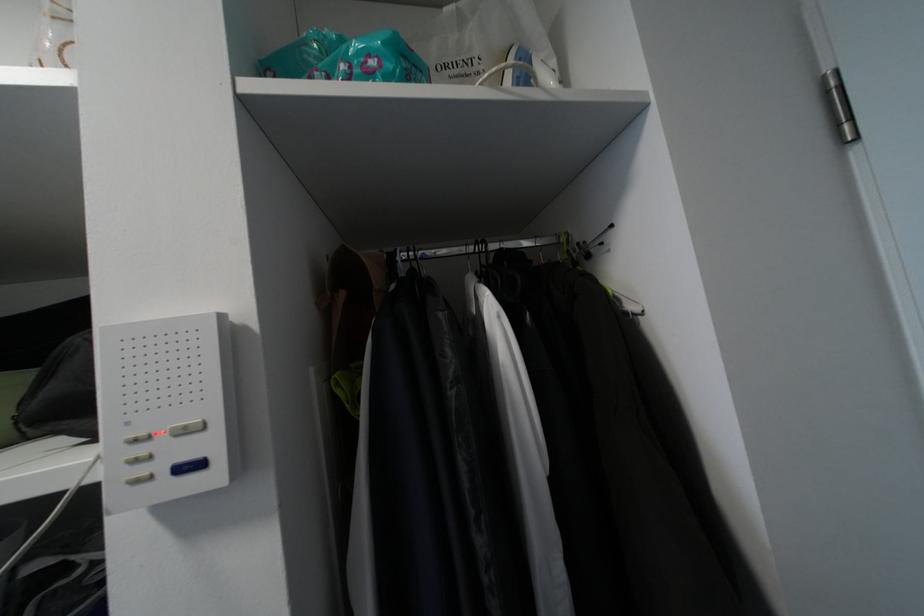
Image resolution: width=924 pixels, height=616 pixels. What do you see at coordinates (188, 466) in the screenshot? I see `the blue control button` at bounding box center [188, 466].